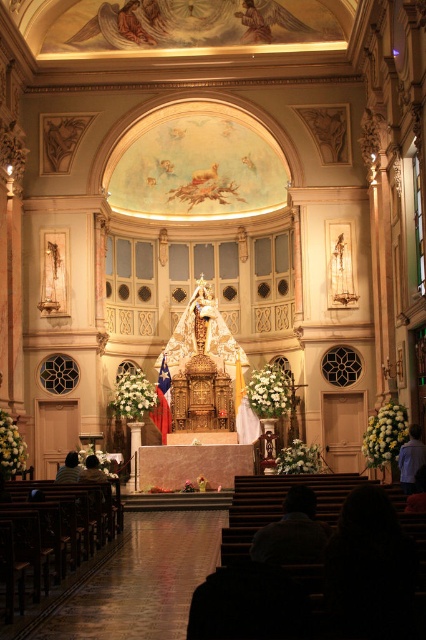
You are standing in the grand church and looking at the altar area. Where is the blue fabric shirt at lower right located in the image?

The blue fabric shirt at lower right is located at point (411, 458) in the image.

You are an usher in the church and need to guide someone to the dark brown leather jacket at lower left. Since the dark brown hair at lower left is blocking the view, can you see the jacket from where you are standing?

The dark brown leather jacket at lower left is located below dark brown hair at lower left, so you cannot see the jacket because it is hidden behind the hair.